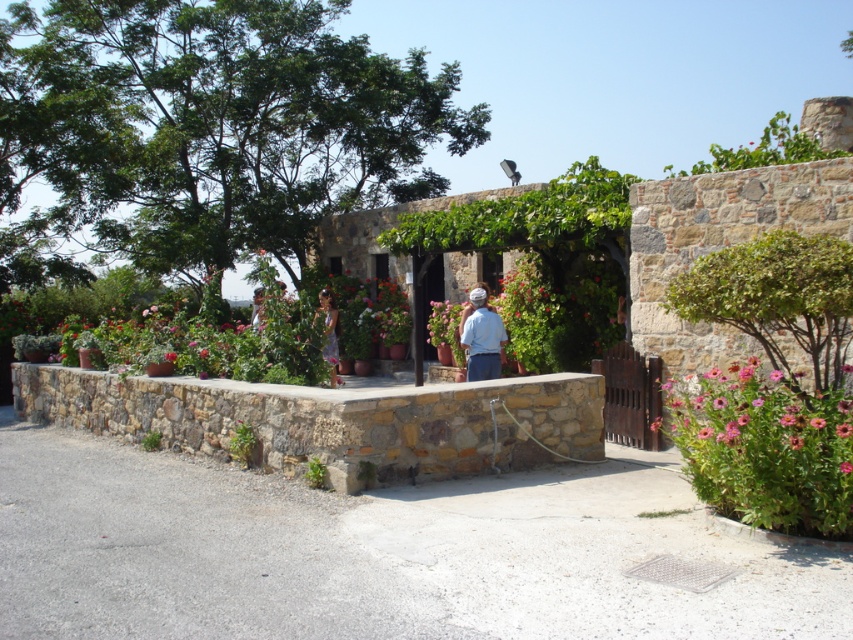
Question: Is matte purple dress at center positioned before pink matte flower at center?

Choices:
 (A) no
 (B) yes

Answer: (A)

Question: Is pink matte flower at lower right thinner than white cotton shirt at center?

Choices:
 (A) no
 (B) yes

Answer: (A)

Question: Among these points, which one is farthest from the camera?

Choices:
 (A) (849, 468)
 (B) (328, 348)

Answer: (B)

Question: Which of these objects is positioned farthest from the pink matte flower at lower right?

Choices:
 (A) pink matte flower at center
 (B) white cotton shirt at center

Answer: (B)

Question: Is white cotton shirt at center below matte purple dress at center?

Choices:
 (A) yes
 (B) no

Answer: (B)

Question: Which object appears farthest from the camera in this image?

Choices:
 (A) pink matte flower at center
 (B) pink matte flower at lower right

Answer: (B)